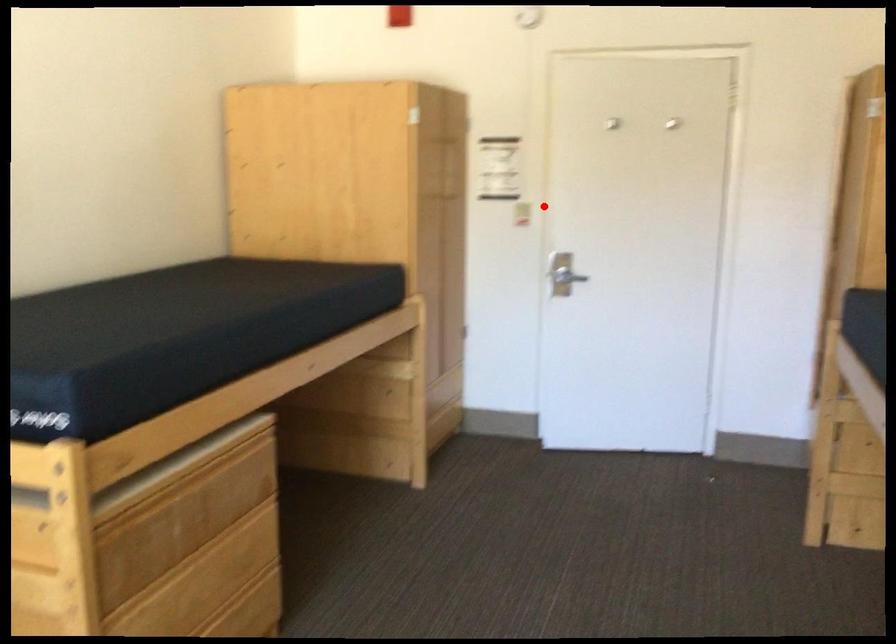
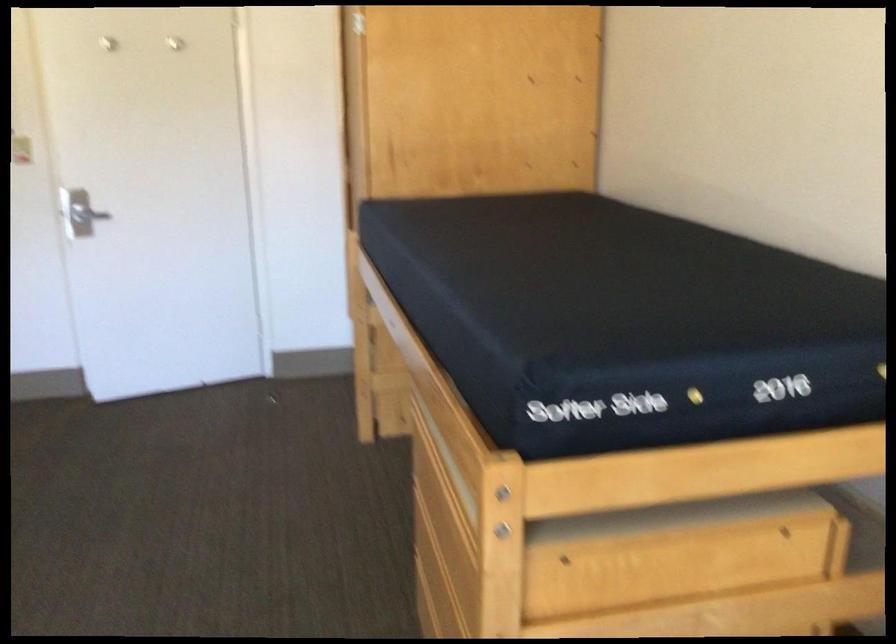
Question: A red point is marked in image1. In image2, is the corresponding 3D point closer to the camera or farther? Reply with the corresponding letter.

Choices:
 (A) The corresponding 3D point is closer.
 (B) The corresponding 3D point is farther.

Answer: (A)